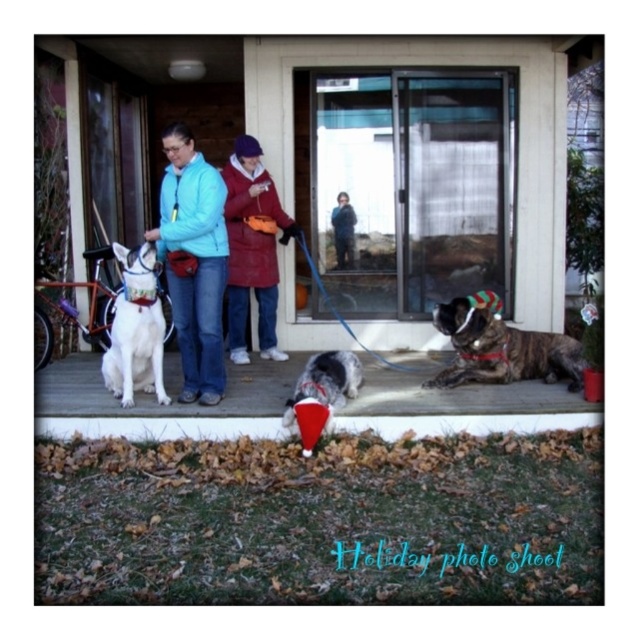
Question: Which of the following is the farthest from the observer?

Choices:
 (A) (325, 416)
 (B) (122, 380)

Answer: (B)

Question: Among these objects, which one is nearest to the camera?

Choices:
 (A) soft gray fur at center
 (B) transparent plastic screen door at center

Answer: (A)

Question: Is white fabric dog at center positioned behind soft gray fur at center?

Choices:
 (A) yes
 (B) no

Answer: (A)

Question: Which point is farther to the camera?

Choices:
 (A) transparent plastic screen door at center
 (B) dark blue fabric jacket at center
 (C) white glossy dog at center

Answer: (B)

Question: Is matte blue jacket at center smaller than soft gray fur at center?

Choices:
 (A) no
 (B) yes

Answer: (A)

Question: Observing the image, what is the correct spatial positioning of white fabric dog at center in reference to brindle fur dog at lower right?

Choices:
 (A) above
 (B) below

Answer: (B)